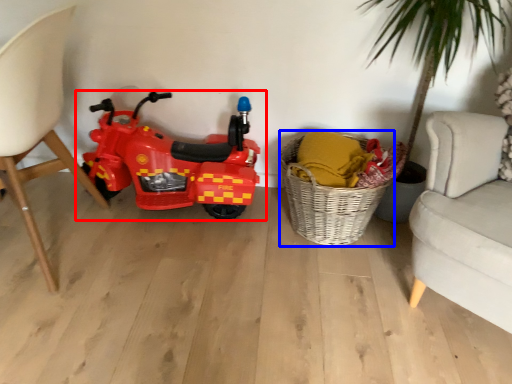
Question: Which object appears farthest to the camera in this image, land vehicle (highlighted by a red box) or basket (highlighted by a blue box)?

Choices:
 (A) land vehicle
 (B) basket

Answer: (A)